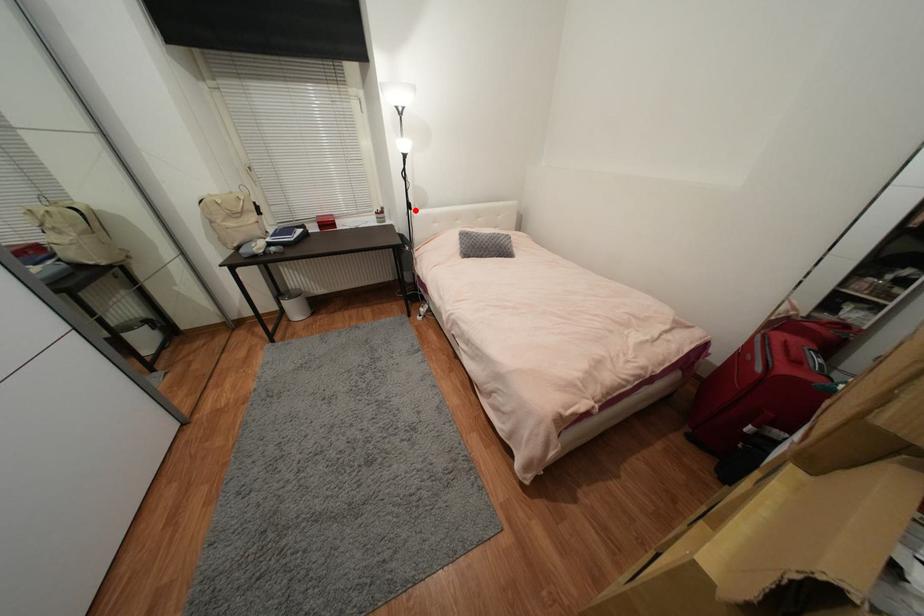
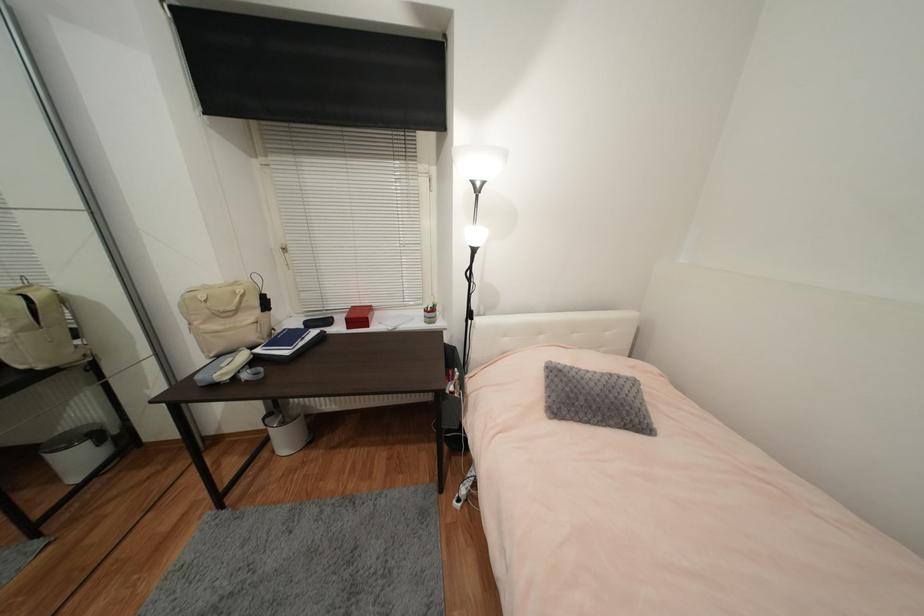
Question: I am providing you with two images of the same scene from different viewpoints. A red point is marked on the first image. Can you still see the location of the red point in image 2?

Choices:
 (A) Yes
 (B) No

Answer: (A)